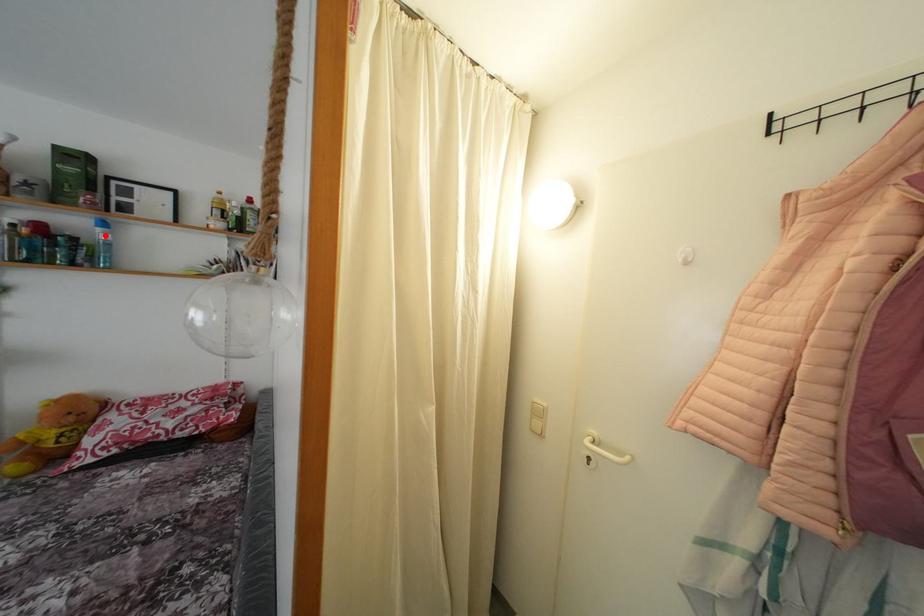
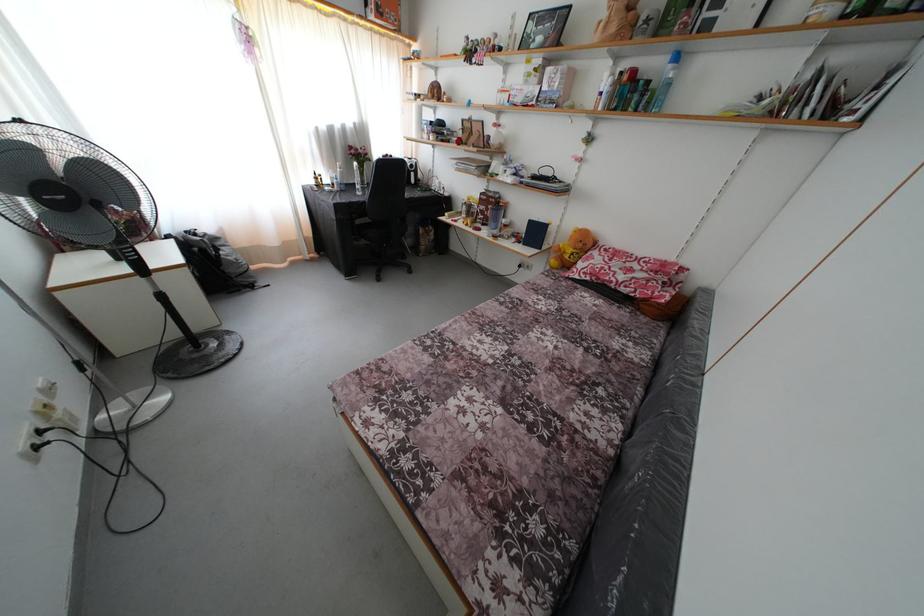
The point at the highlighted location is marked in the first image. Where is the corresponding point in the second image?

(675, 73)